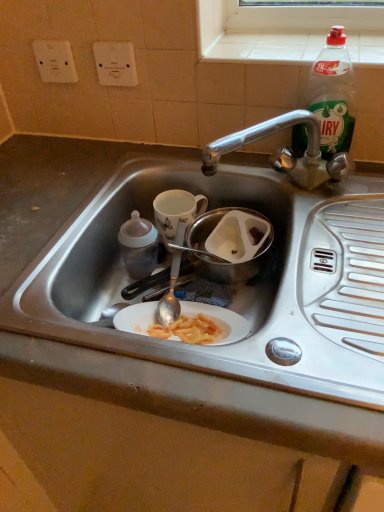
You are a GUI agent. You are given a task and a screenshot of the screen. Output one action in this format:
    pyautogui.click(x=<x>, y=<y>)
    Task: Click on the free space to the left of green plastic bottle at upper right, which is the second bottle from left to right
    The height and width of the screenshot is (512, 384).
    Given the screenshot: What is the action you would take?
    pyautogui.click(x=247, y=165)